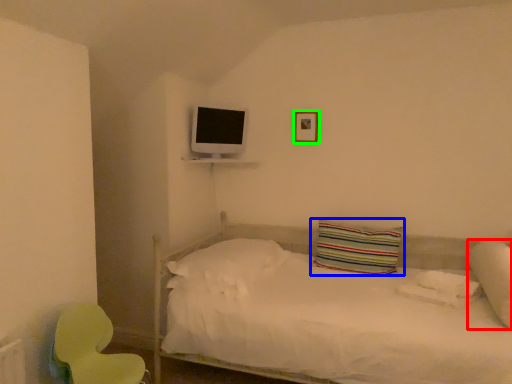
Question: Based on their relative distances, which object is nearer to pillow (highlighted by a red box)? Choose from pillow (highlighted by a blue box) and picture frame (highlighted by a green box).

Choices:
 (A) pillow
 (B) picture frame

Answer: (A)